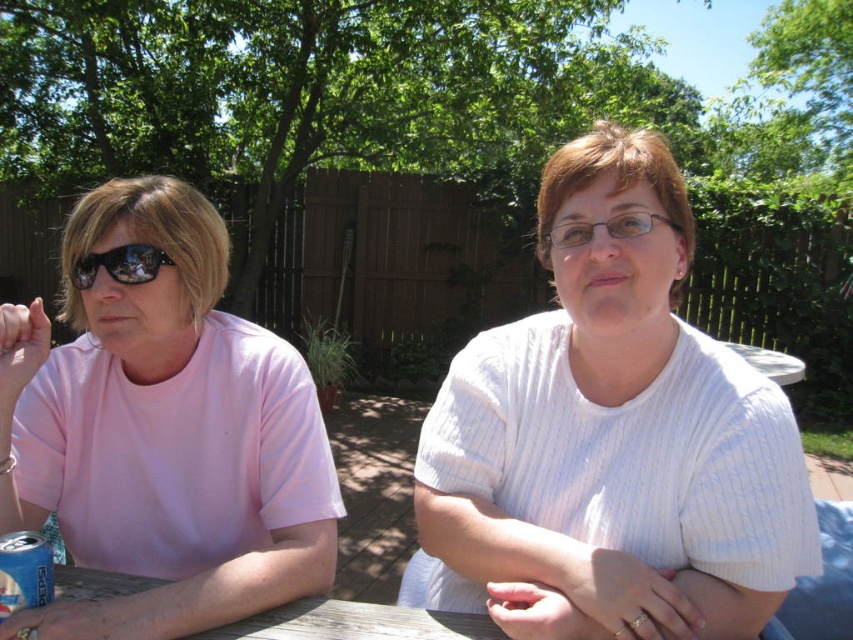
Consider the image. Does pink matte shirt at left appear on the right side of wooden table at center?

In fact, pink matte shirt at left is to the left of wooden table at center.

Is pink matte shirt at left above wooden table at center?

Yes.

Find the location of `pink matte shirt at left`. pink matte shirt at left is located at coordinates (163, 432).

Find the location of a particular element. The height and width of the screenshot is (640, 853). pink matte shirt at left is located at coordinates (163, 432).

Is blue metallic can at lower left wider than clear plastic glasses at center?

In fact, blue metallic can at lower left might be narrower than clear plastic glasses at center.

Which is in front, point (18, 605) or point (665, 224)?

Positioned in front is point (18, 605).

Locate an element on the screen. Image resolution: width=853 pixels, height=640 pixels. blue metallic can at lower left is located at coordinates (24, 572).

Does matte black sunglasses at left have a lesser width compared to clear plastic glasses at center?

Yes.

Which is behind, point (160, 266) or point (636, 228)?

The point (160, 266) is behind.

The image size is (853, 640). What are the coordinates of `matte black sunglasses at left` in the screenshot? It's located at (120, 264).